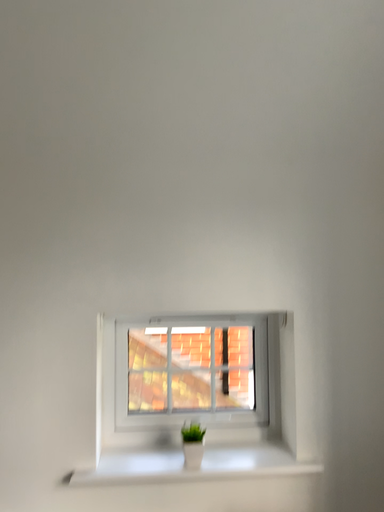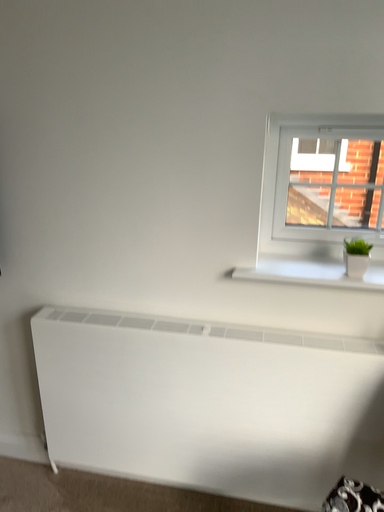
Question: Which way did the camera rotate in the video?

Choices:
 (A) rotated right
 (B) rotated left

Answer: (B)